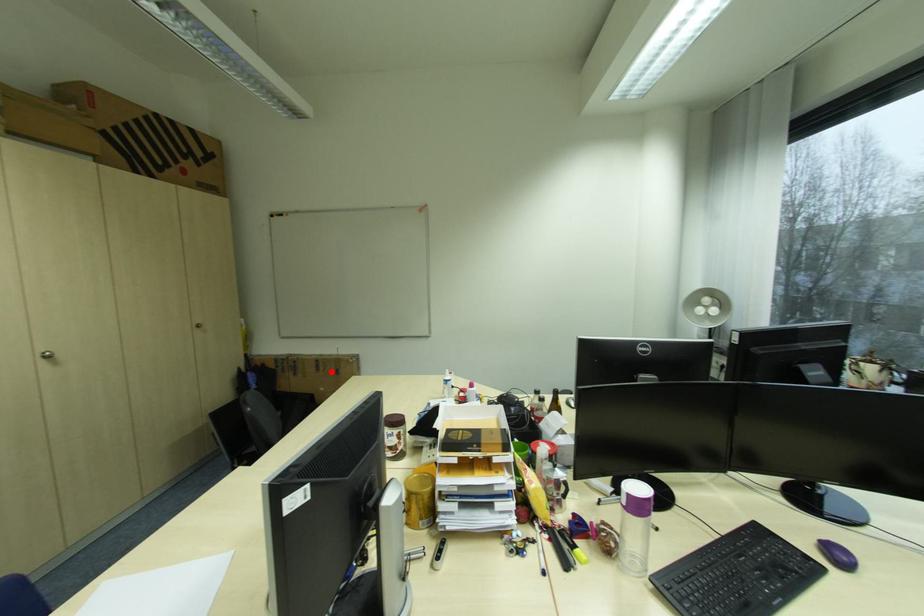
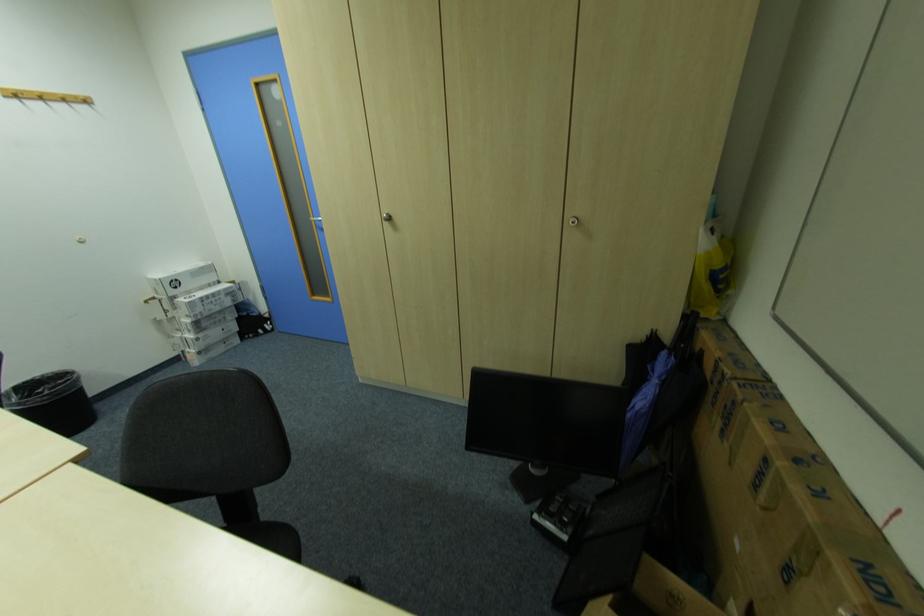
The point at the highlighted location is marked in the first image. Where is the corresponding point in the second image?

(772, 509)